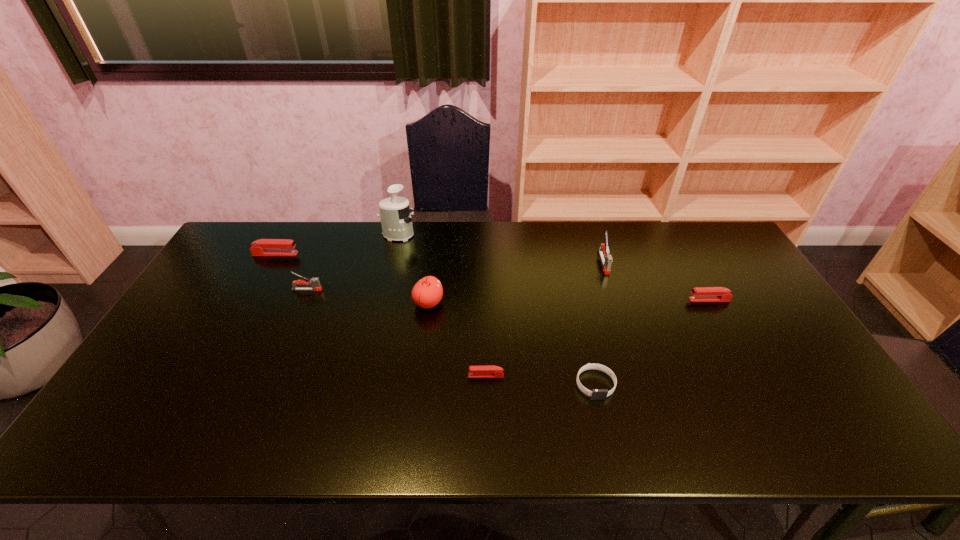
Where is `the second closest red stapler to the fifth object from right to left`? the second closest red stapler to the fifth object from right to left is located at coordinates (263, 247).

Select which red stapler is the closest to the leftmost red stapler. Please provide its 2D coordinates. Your answer should be formatted as a tuple, i.e. [(x, y)], where the tuple contains the x and y coordinates of a point satisfying the conditions above.

[(490, 371)]